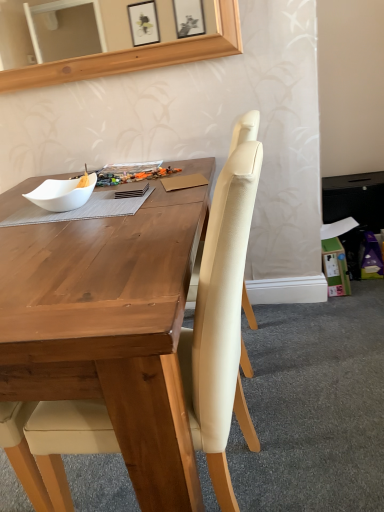
Question: Based on their sizes in the image, would you say green cardboard box at lower right is bigger or smaller than white matte bowl at left?

Choices:
 (A) big
 (B) small

Answer: (A)

Question: Considering the positions of green cardboard box at lower right and white matte bowl at left in the image, is green cardboard box at lower right wider or thinner than white matte bowl at left?

Choices:
 (A) wide
 (B) thin

Answer: (A)

Question: Estimate the real-world distances between objects in this image. Which object is closer to the green cardboard box at lower right?

Choices:
 (A) white matte bowl at left
 (B) beige fabric chair at center

Answer: (A)

Question: Considering the real-world distances, which object is closest to the beige fabric chair at center?

Choices:
 (A) green cardboard box at lower right
 (B) white matte bowl at left

Answer: (B)